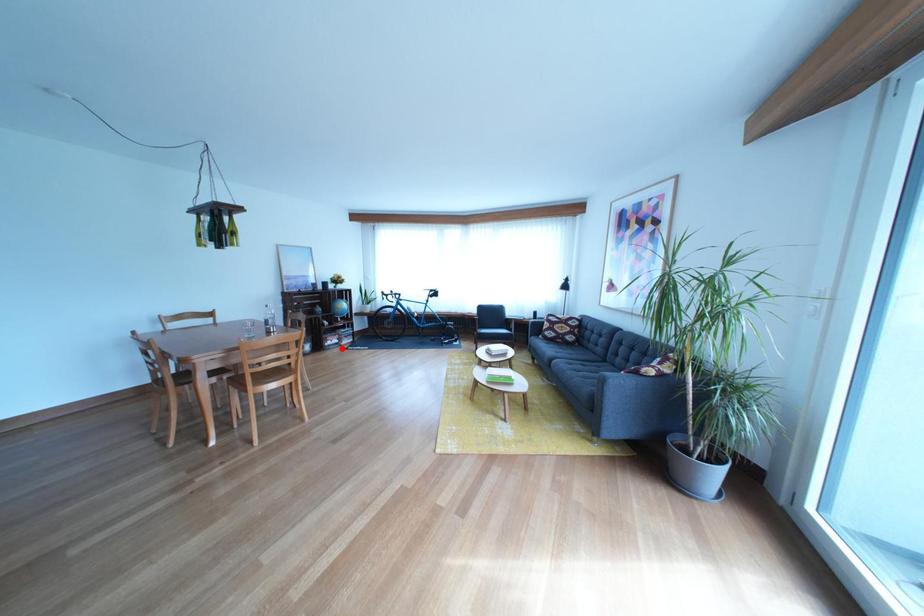
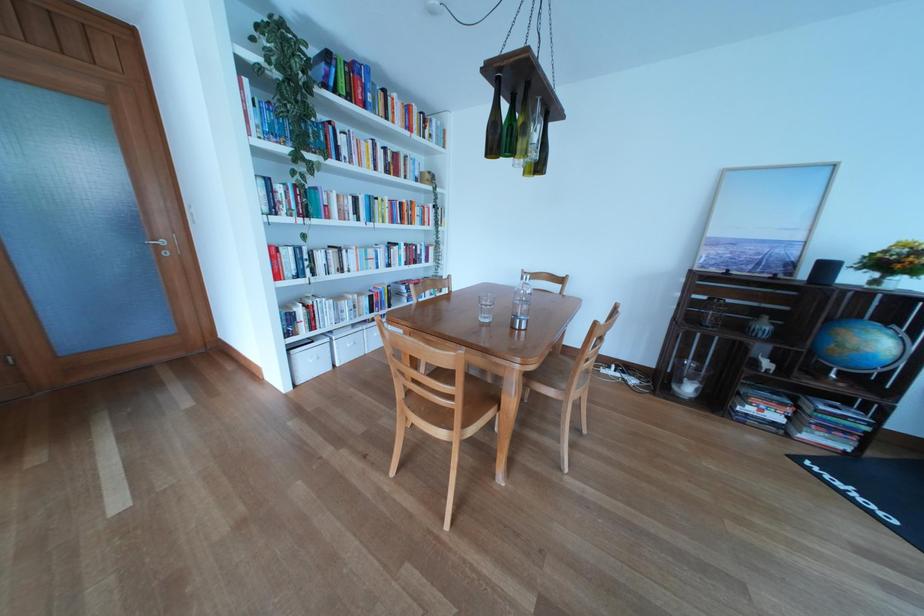
Question: I am providing you with two images of the same scene from different viewpoints. A red point is shown in image1. For the corresponding object point in image2, is it positioned nearer or farther from the camera?

Choices:
 (A) Nearer
 (B) Farther

Answer: (B)